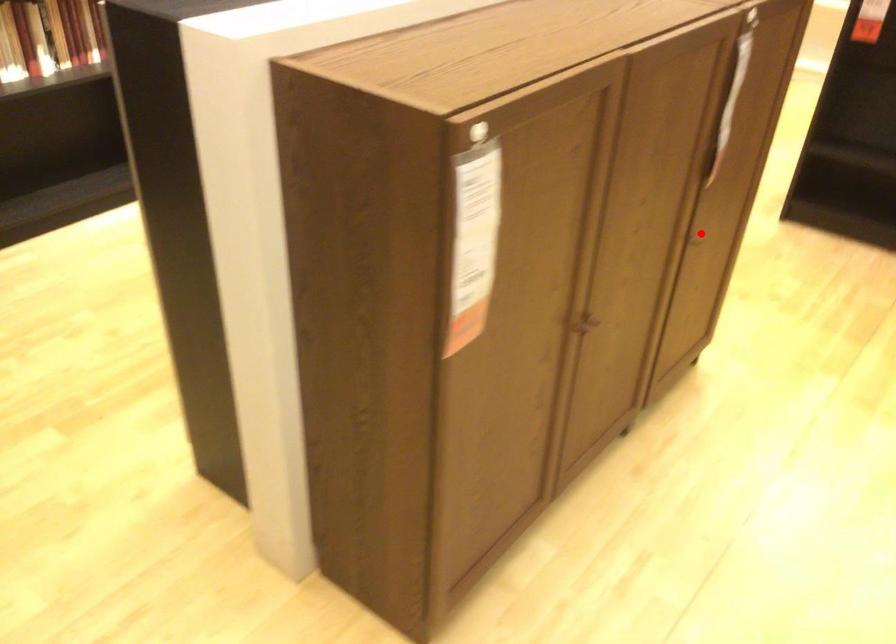
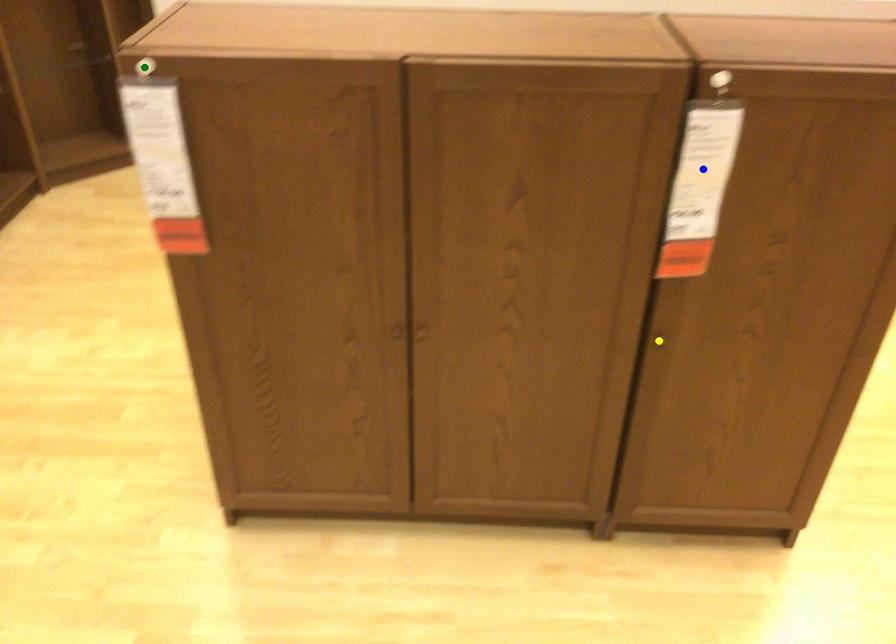
Question: I am providing you with two images of the same scene from different viewpoints. A red point is marked on the first image. You are given multiple points on the second image. Which point in image 2 is actually the same real-world point as the red point in image 1?

Choices:
 (A) yellow point
 (B) green point
 (C) blue point

Answer: (A)